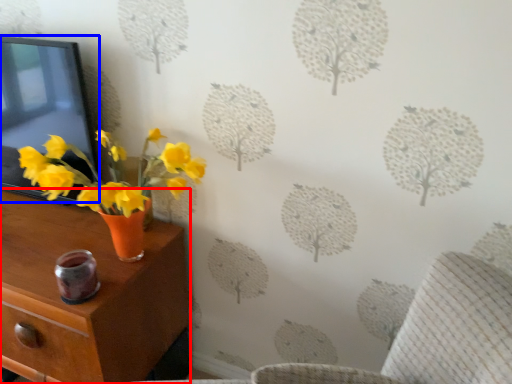
Question: Which object is further to the camera taking this photo, nightstand (highlighted by a red box) or picture frame (highlighted by a blue box)?

Choices:
 (A) nightstand
 (B) picture frame

Answer: (B)